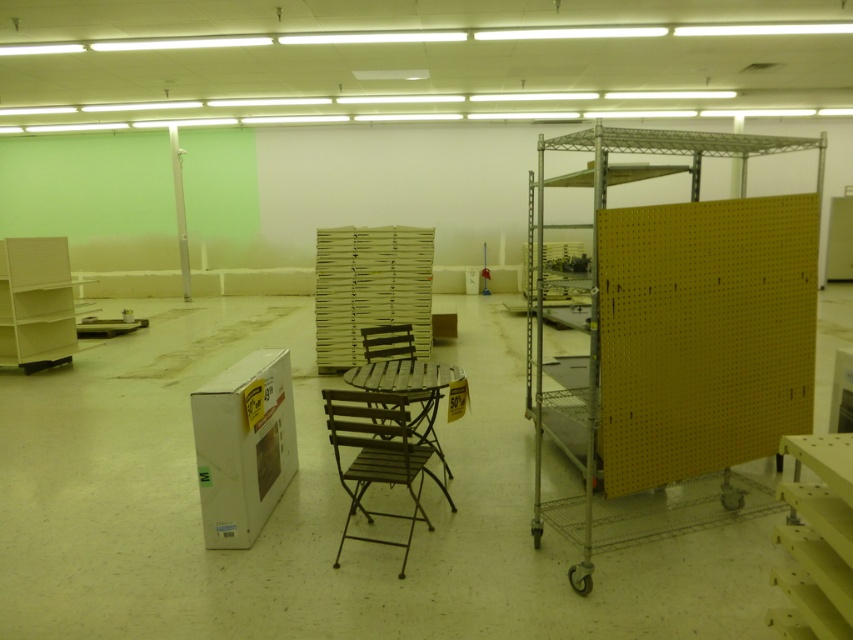
You are standing in the storage area and need to place an object at a closer point to you. Which point should you choose between point (772, 285) and point (444, 376)?

Point (772, 285) is closer to the viewer than point (444, 376). Therefore, you should choose point (772, 285) to place the object closer to yourself.

You are organizing tools in the storage area and need to place a heavy tool on a surface. Which object, the yellow pegboard at right or the brown wood table at center, is suitable for placing heavy items?

The brown wood table at center is suitable for placing heavy items because the yellow pegboard at right is above it and likely not a stable surface for heavy objects.

You are an inventory manager checking the storage area. You need to locate the yellow pegboard at right. According to the coordinates provided, where should you look in the storage area?

The yellow pegboard at right is located at point [672,340] in the storage area.